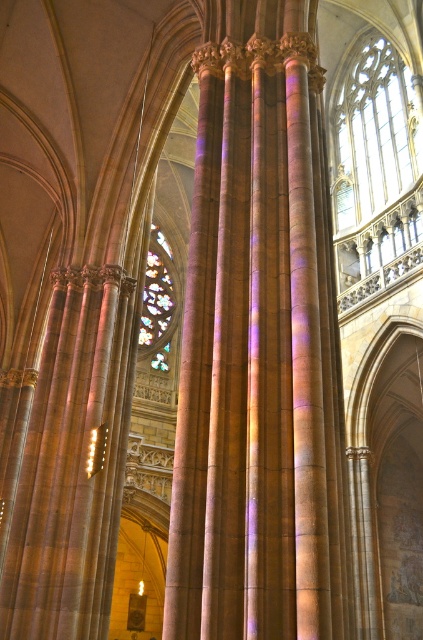
You are standing at the entrance of the cathedral and see the point marked as point [158,301]. What is the object located at this point?

The point [158,301] corresponds to the stained glass window at center.

You are an architect designing a new cathedral and want to incorporate elements from this image. Which object from the scene has a bigger size between the clear glass window at upper right and the metallic gold light at center?

The clear glass window at upper right has a larger size compared to the metallic gold light at center, so it is bigger in size between the two.

You are standing at the entrance of the cathedral and want to take a photo of the stained glass window at center. According to the coordinates provided, in which direction should you move to position yourself directly in front of it?

The stained glass window at center is located at coordinates point 0.473 on the x axis and 0.374 on the y axis. Since you are at the entrance, you should move forward along the central axis towards the stained glass window at center to position yourself directly in front of it.